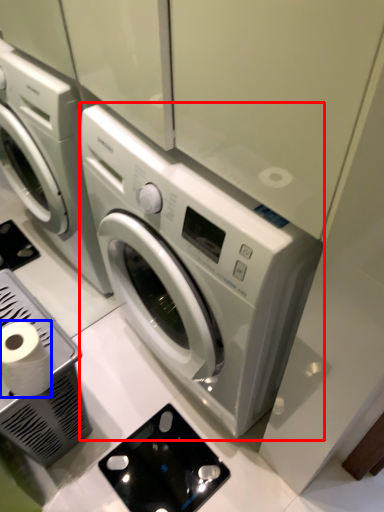
Question: Which of the following is the farthest to the observer, washing machine (highlighted by a red box) or toilet paper (highlighted by a blue box)?

Choices:
 (A) washing machine
 (B) toilet paper

Answer: (B)